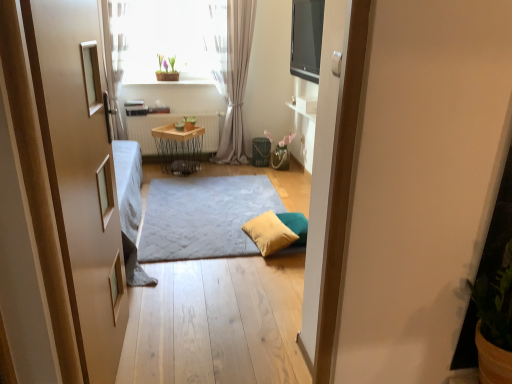
Find the location of a particular element. This screenshot has width=512, height=384. vacant region above green matte pot at upper center (from a real-world perspective) is located at coordinates (163, 49).